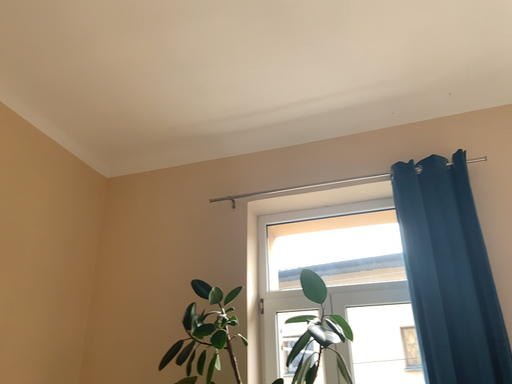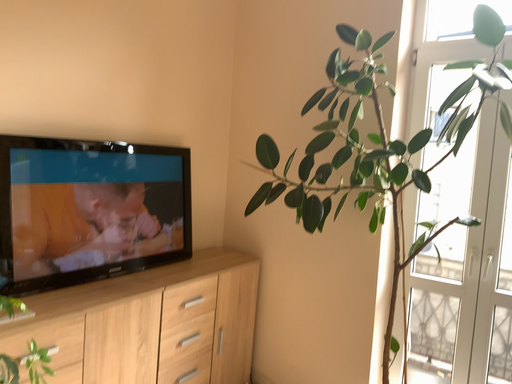
Question: How did the camera likely rotate when shooting the video?

Choices:
 (A) rotated left
 (B) rotated right

Answer: (A)